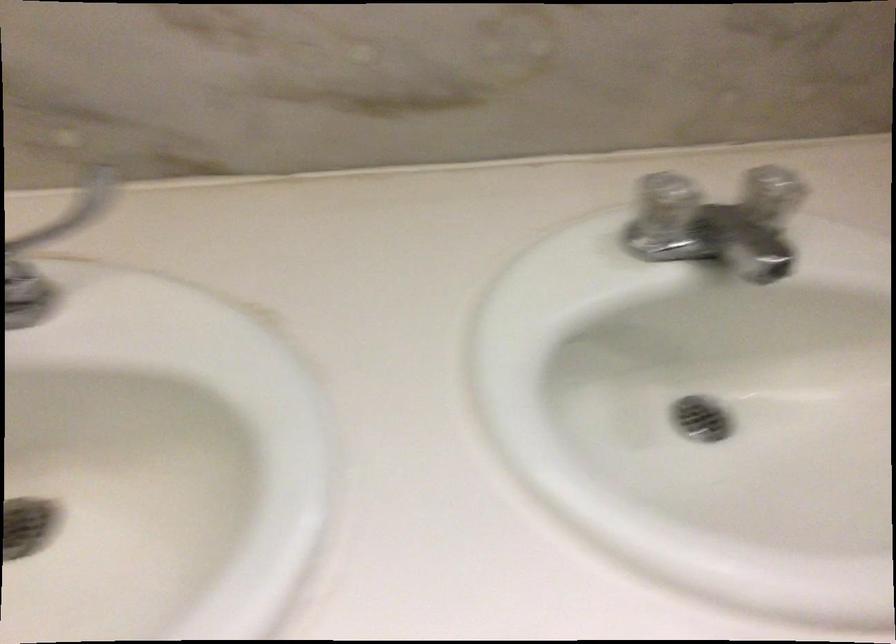
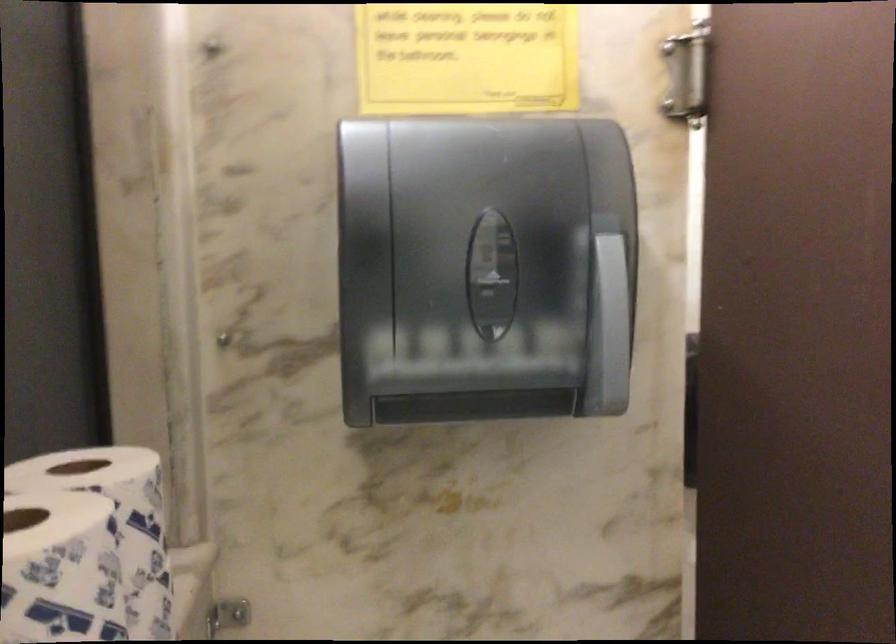
Question: The images are taken continuously from a first-person perspective. In which direction is your viewpoint rotating?

Choices:
 (A) Left
 (B) Right
 (C) Up
 (D) Down

Answer: (B)